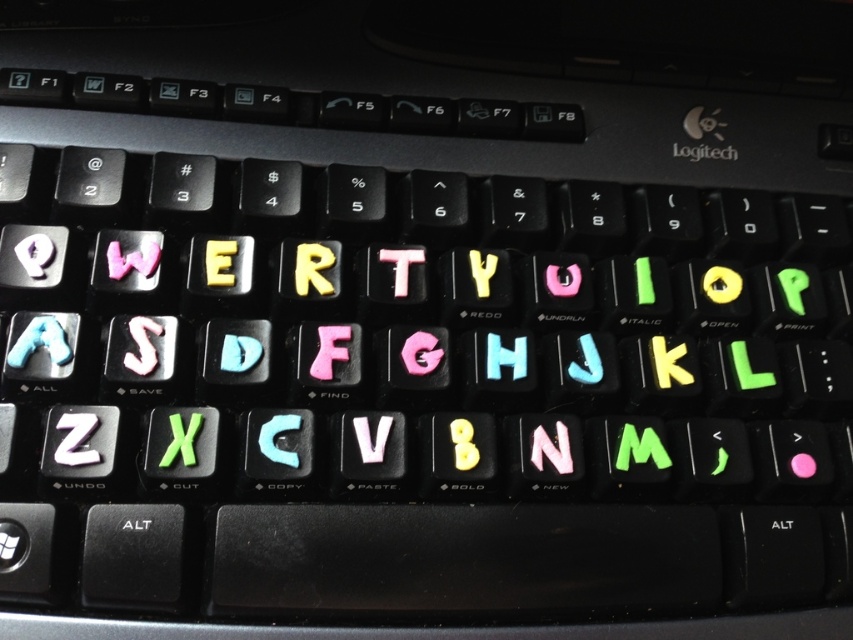
You are setting up a custom keyboard and need to adjust the height of two keys. You have the pink matte letter g at center and the white plastic t at center. Which key will require a taller adjustment to match the other?

The pink matte letter g at center is not as tall as the white plastic t at center, so you need to adjust the pink matte letter g at center to be taller to match the white plastic t at center.